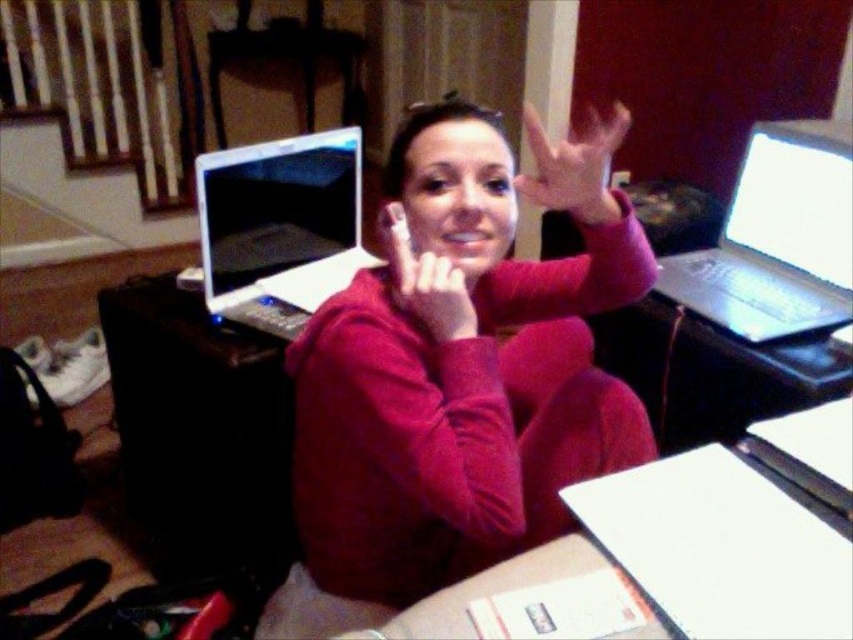
Image resolution: width=853 pixels, height=640 pixels. Describe the element at coordinates (663, 563) in the screenshot. I see `white paper at center` at that location.

Can you confirm if white paper at center is positioned above matte pink hand at center?

Actually, white paper at center is below matte pink hand at center.

The height and width of the screenshot is (640, 853). What do you see at coordinates (663, 563) in the screenshot? I see `white paper at center` at bounding box center [663, 563].

Locate an element on the screen. The width and height of the screenshot is (853, 640). white paper at center is located at coordinates (663, 563).

Does black glossy laptop at upper right appear over matte pink hand at upper center?

No, black glossy laptop at upper right is not above matte pink hand at upper center.

Identify the location of black glossy laptop at upper right. (776, 237).

Is matte pink hoodie at center above matte pink hand at upper center?

Incorrect, matte pink hoodie at center is not positioned above matte pink hand at upper center.

Where is `matte pink hoodie at center`? The width and height of the screenshot is (853, 640). matte pink hoodie at center is located at coordinates (463, 364).

Find the location of `matte pink hoodie at center`. matte pink hoodie at center is located at coordinates (463, 364).